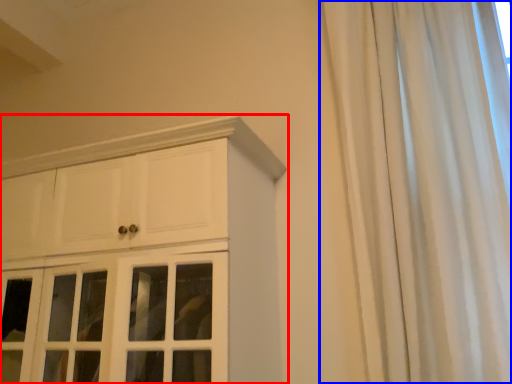
Question: Which object appears closest to the camera in this image, cupboard (highlighted by a red box) or curtain (highlighted by a blue box)?

Choices:
 (A) cupboard
 (B) curtain

Answer: (B)